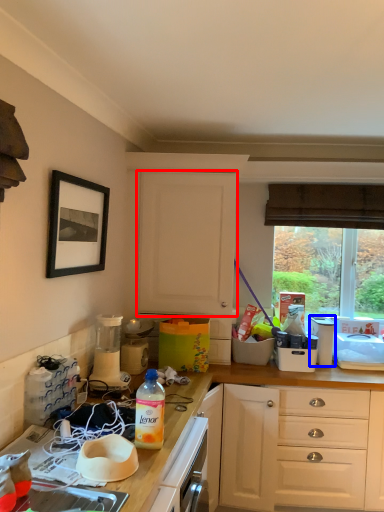
Question: Which object appears farthest to the camera in this image, cabinetry (highlighted by a red box) or appliance (highlighted by a blue box)?

Choices:
 (A) cabinetry
 (B) appliance

Answer: (B)